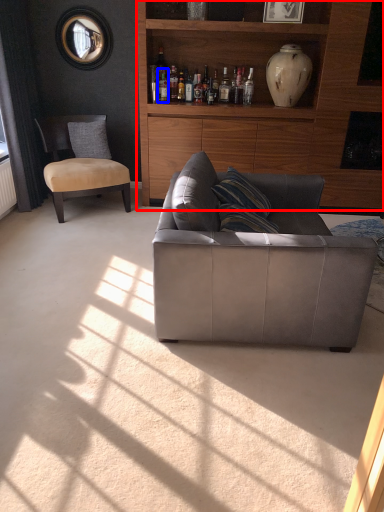
Question: Which point is further to the camera, cabinetry (highlighted by a red box) or bottle (highlighted by a blue box)?

Choices:
 (A) cabinetry
 (B) bottle

Answer: (B)